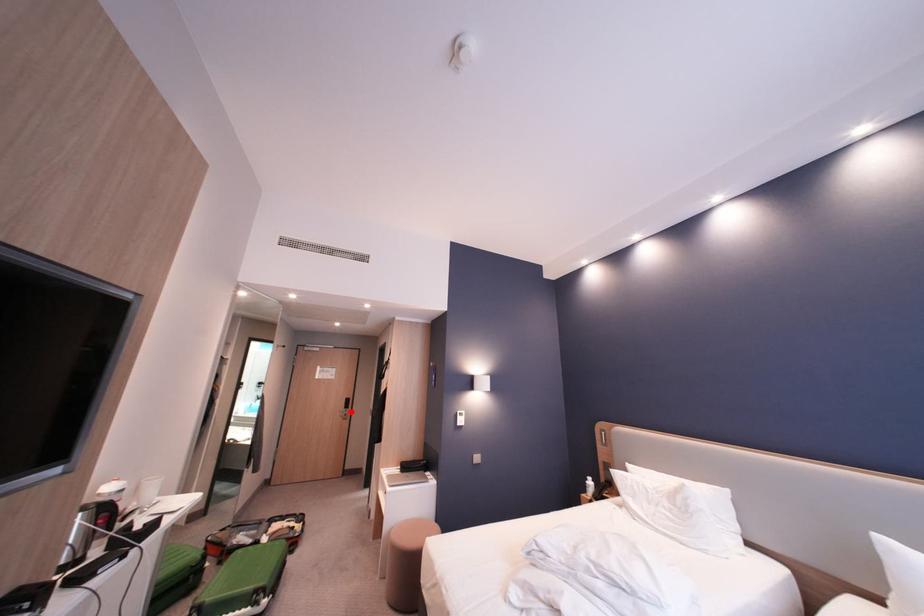
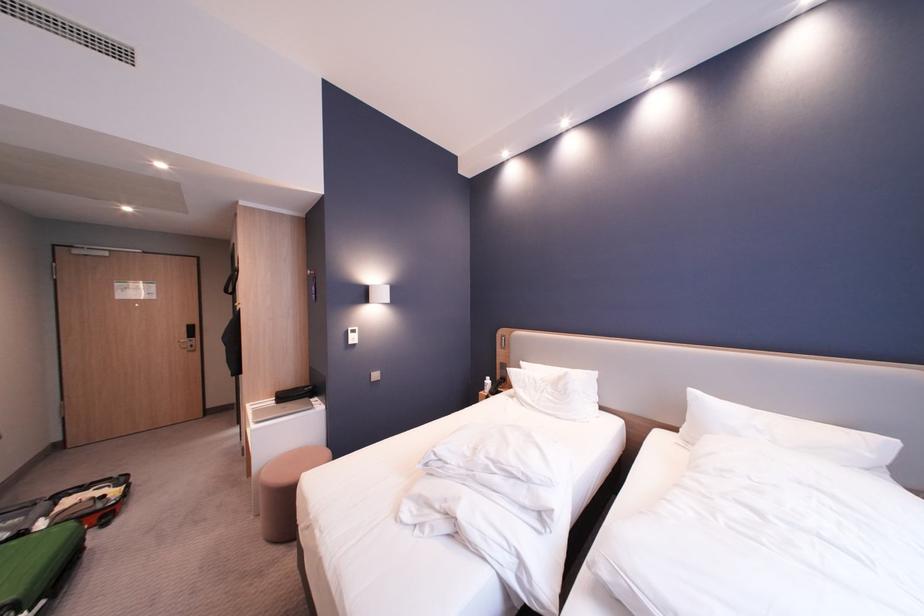
Question: I am providing you with two images of the same scene from different viewpoints. A red point is shown in image1. For the corresponding object point in image2, is it positioned nearer or farther from the camera?

Choices:
 (A) Nearer
 (B) Farther

Answer: (A)